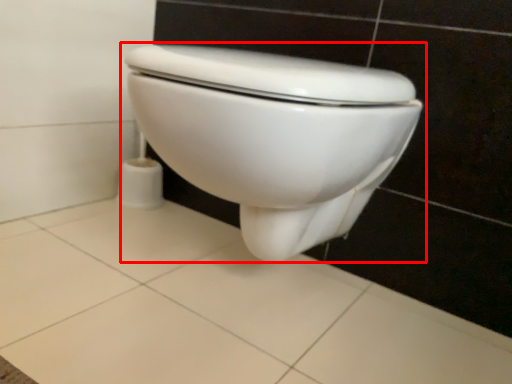
Question: Observing the image, what is the correct spatial positioning of toilet (annotated by the red box) in reference to ceramic tile?

Choices:
 (A) left
 (B) right

Answer: (B)